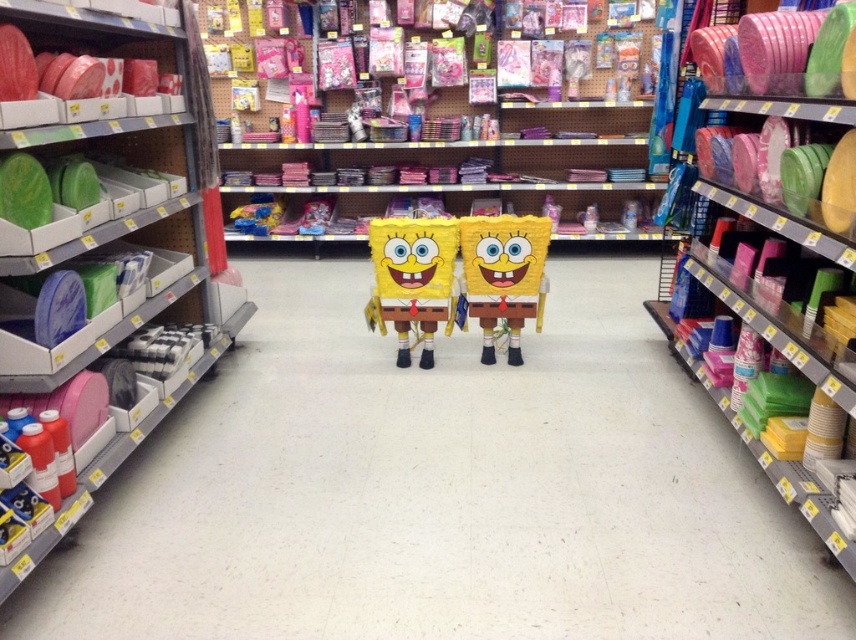
Question: Considering the real-world distances, which object is farthest from the yellow matte sponge at center?

Choices:
 (A) green matte plates at left
 (B) matte yellow sponge at center

Answer: (B)

Question: Does matte yellow sponge at center appear on the left side of matte plastic plates at right?

Choices:
 (A) yes
 (B) no

Answer: (A)

Question: Which of the following is the closest to the observer?

Choices:
 (A) (191, 179)
 (B) (498, 262)

Answer: (A)

Question: Which point is farther to the camera?

Choices:
 (A) matte yellow sponge at center
 (B) yellow matte sponge at center
 (C) matte plastic plates at right
 (D) green matte plates at left

Answer: (A)

Question: Is matte yellow sponge at center wider than matte plastic plates at right?

Choices:
 (A) no
 (B) yes

Answer: (B)

Question: Does green matte plates at left have a smaller size compared to yellow matte sponge at center?

Choices:
 (A) yes
 (B) no

Answer: (B)